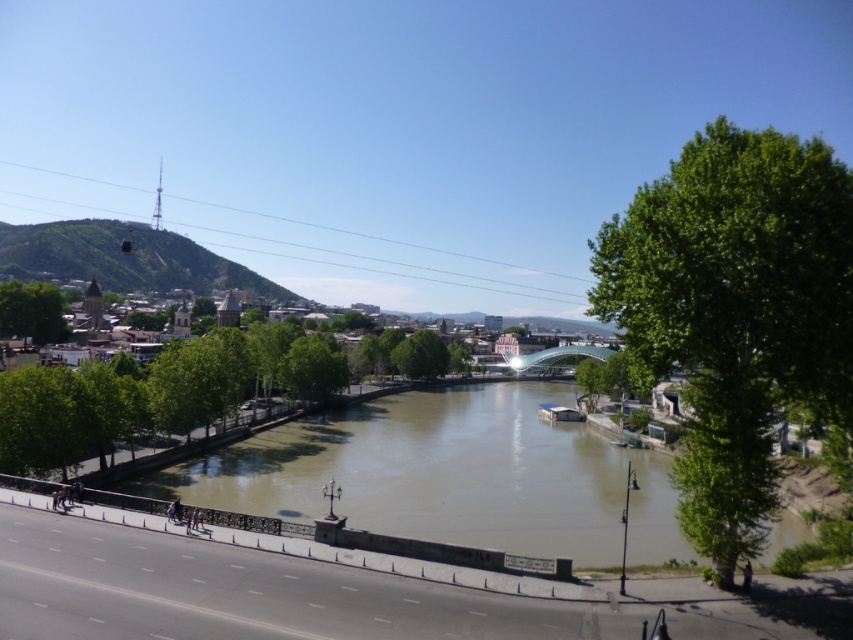
Question: Which point appears closest to the camera in this image?

Choices:
 (A) (444, 369)
 (B) (532, 365)

Answer: (A)

Question: Where is brown murky water at center located in relation to transparent glass bridge at center in the image?

Choices:
 (A) above
 (B) below

Answer: (B)

Question: Can you confirm if green leafy tree at left is positioned above green leafy tree at center?

Choices:
 (A) no
 (B) yes

Answer: (B)

Question: Which point appears farthest from the camera in this image?

Choices:
 (A) (593, 355)
 (B) (440, 365)
 (C) (634, 451)

Answer: (A)

Question: In this image, where is brown murky water at center located relative to green leafy tree at center?

Choices:
 (A) left
 (B) right

Answer: (B)

Question: Which point is farther to the camera?

Choices:
 (A) green leafy tree at center
 (B) brown murky water at center
 (C) green leafy tree at right
 (D) transparent glass bridge at center

Answer: (A)